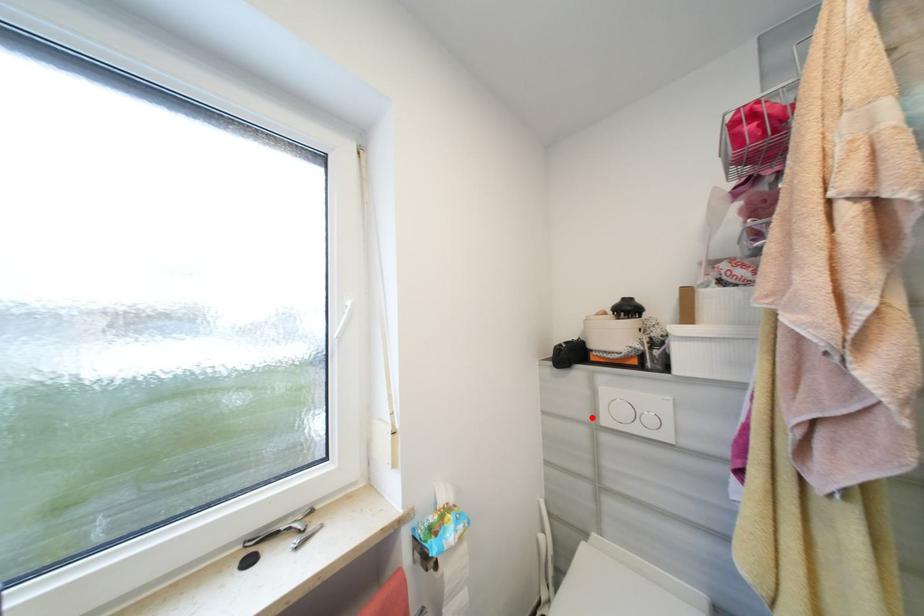
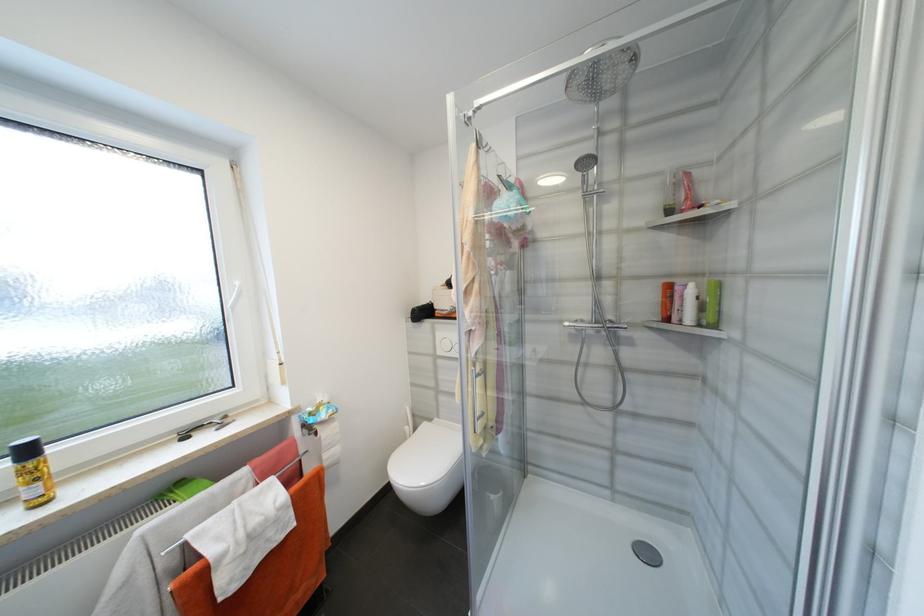
Locate, in the second image, the point that corresponds to the highlighted location in the first image.

(436, 352)